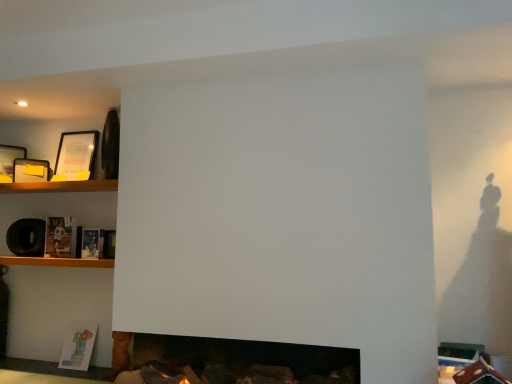
The image size is (512, 384). I want to click on vacant region below matte paper book at left, which is the first book in top-to-bottom order (from a real-world perspective), so click(65, 255).